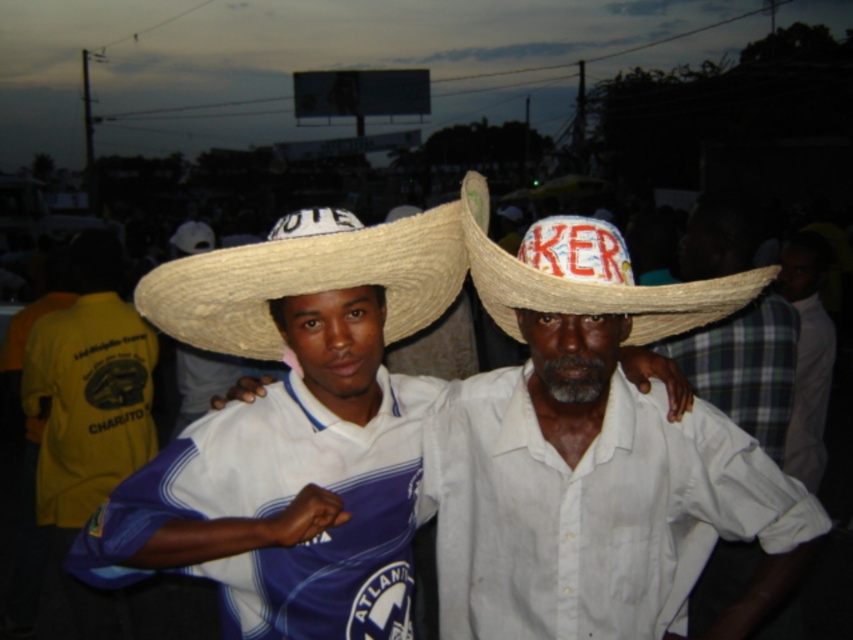
Question: Which of the following is the farthest from the observer?

Choices:
 (A) (570, 241)
 (B) (193, 310)
 (C) (221, 282)

Answer: (B)

Question: Does natural straw sombrero at center have a lesser width compared to natural straw hat at center?

Choices:
 (A) yes
 (B) no

Answer: (B)

Question: Among these points, which one is farthest from the camera?

Choices:
 (A) [387, 292]
 (B) [657, 545]

Answer: (A)

Question: Can you confirm if natural straw hat at center is positioned below plaid fabric shirt at right?

Choices:
 (A) yes
 (B) no

Answer: (B)

Question: Which object appears closest to the camera in this image?

Choices:
 (A) natural straw hat at center
 (B) plaid fabric shirt at right
 (C) natural straw sombrero at center
 (D) straw hat at center

Answer: (C)

Question: Can you confirm if straw hat at center is positioned below natural straw hat at center?

Choices:
 (A) yes
 (B) no

Answer: (A)